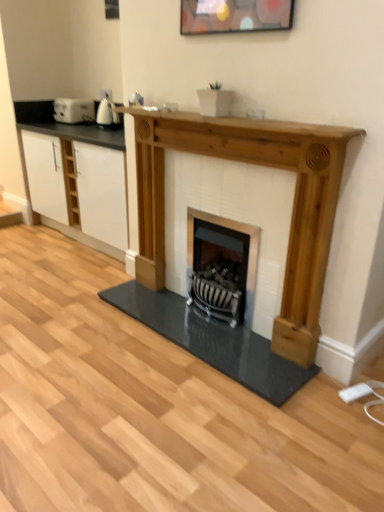
Question: Could you tell me if wooden shelf at center is facing black metal wood burning stove at center?

Choices:
 (A) no
 (B) yes

Answer: (A)

Question: Does wooden shelf at center have a smaller size compared to black metal wood burning stove at center?

Choices:
 (A) no
 (B) yes

Answer: (B)

Question: From the image's perspective, is wooden shelf at center on top of black metal wood burning stove at center?

Choices:
 (A) yes
 (B) no

Answer: (A)

Question: Is black metal wood burning stove at center at the back of wooden shelf at center?

Choices:
 (A) yes
 (B) no

Answer: (B)

Question: Considering the relative sizes of wooden shelf at center and black metal wood burning stove at center in the image provided, is wooden shelf at center shorter than black metal wood burning stove at center?

Choices:
 (A) yes
 (B) no

Answer: (A)

Question: Relative to wooden shelf at center, is black metal wood burning stove at center in front or behind?

Choices:
 (A) behind
 (B) front

Answer: (A)

Question: From the image's perspective, relative to wooden shelf at center, is black metal wood burning stove at center above or below?

Choices:
 (A) below
 (B) above

Answer: (A)

Question: From a real-world perspective, relative to wooden shelf at center, is black metal wood burning stove at center vertically above or below?

Choices:
 (A) above
 (B) below

Answer: (B)

Question: Considering the positions of black metal wood burning stove at center and wooden shelf at center in the image, is black metal wood burning stove at center wider or thinner than wooden shelf at center?

Choices:
 (A) thin
 (B) wide

Answer: (A)

Question: From their relative heights in the image, would you say natural wood fireplace at center is taller or shorter than black metal wood burning stove at center?

Choices:
 (A) tall
 (B) short

Answer: (A)

Question: From the image's perspective, is natural wood fireplace at center positioned above or below black metal wood burning stove at center?

Choices:
 (A) below
 (B) above

Answer: (B)

Question: From a real-world perspective, is natural wood fireplace at center positioned above or below black metal wood burning stove at center?

Choices:
 (A) below
 (B) above

Answer: (B)

Question: Choose the correct answer: Is natural wood fireplace at center inside black metal wood burning stove at center or outside it?

Choices:
 (A) inside
 (B) outside

Answer: (B)

Question: In terms of width, does white glossy kettle at upper left, arranged as the first appliance when viewed from the right, look wider or thinner when compared to natural wood fireplace at center?

Choices:
 (A) wide
 (B) thin

Answer: (B)

Question: In the image, is white glossy kettle at upper left, the second appliance when ordered from back to front, on the left side or the right side of natural wood fireplace at center?

Choices:
 (A) right
 (B) left

Answer: (B)